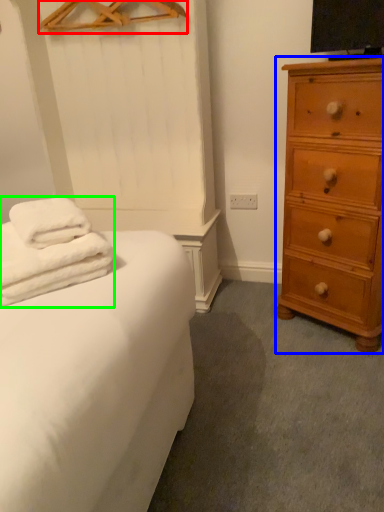
Question: Which is nearer to the hanger (highlighted by a red box)? chest of drawers (highlighted by a blue box) or bath towel (highlighted by a green box).

Choices:
 (A) chest of drawers
 (B) bath towel

Answer: (A)